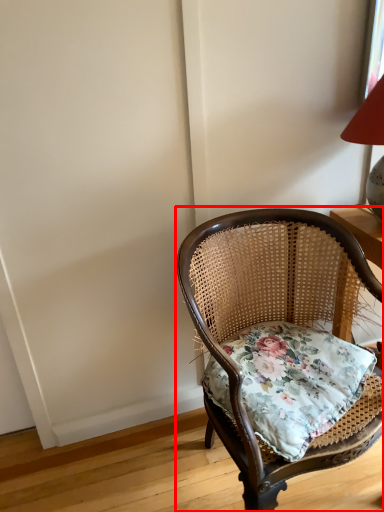
Question: In this image, where is chair (annotated by the red box) located relative to pillow?

Choices:
 (A) left
 (B) right

Answer: (A)